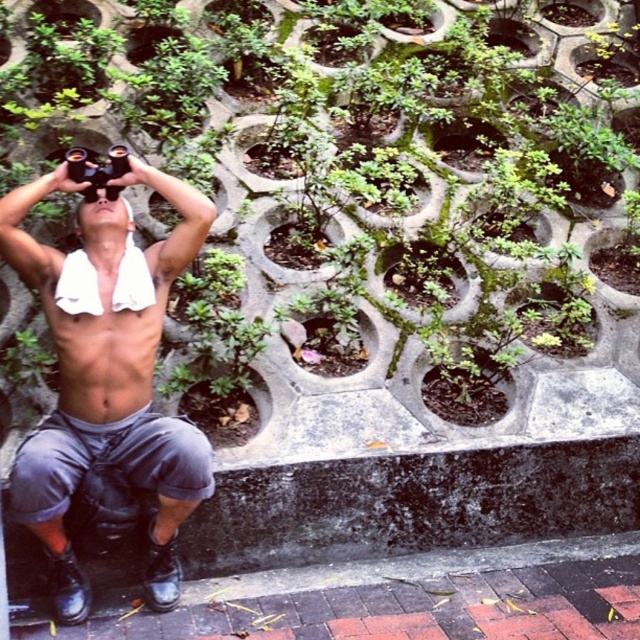
Is green leafy plant at center to the right of shiny black binoculars at upper center from the viewer's perspective?

Yes, green leafy plant at center is to the right of shiny black binoculars at upper center.

Where is `green leafy plant at center`? The height and width of the screenshot is (640, 640). green leafy plant at center is located at coordinates (349, 172).

In order to click on green leafy plant at center in this screenshot , I will do `click(349, 172)`.